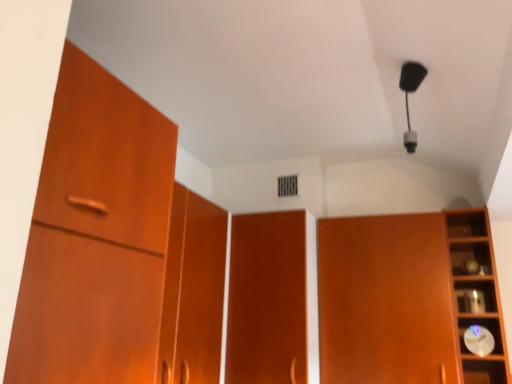
Question: From the image's perspective, is wooden clock at right above or below matte wood cupboard at right?

Choices:
 (A) below
 (B) above

Answer: (B)

Question: Looking at the image, does wooden clock at right seem bigger or smaller compared to matte wood cupboard at right?

Choices:
 (A) small
 (B) big

Answer: (A)

Question: Which of these objects is positioned farthest from the wooden clock at right?

Choices:
 (A) matte wood cupboard at right
 (B) matte wood door at center

Answer: (B)

Question: Estimate the real-world distances between objects in this image. Which object is farther from the matte wood door at center?

Choices:
 (A) wooden clock at right
 (B) matte wood cupboard at right

Answer: (A)